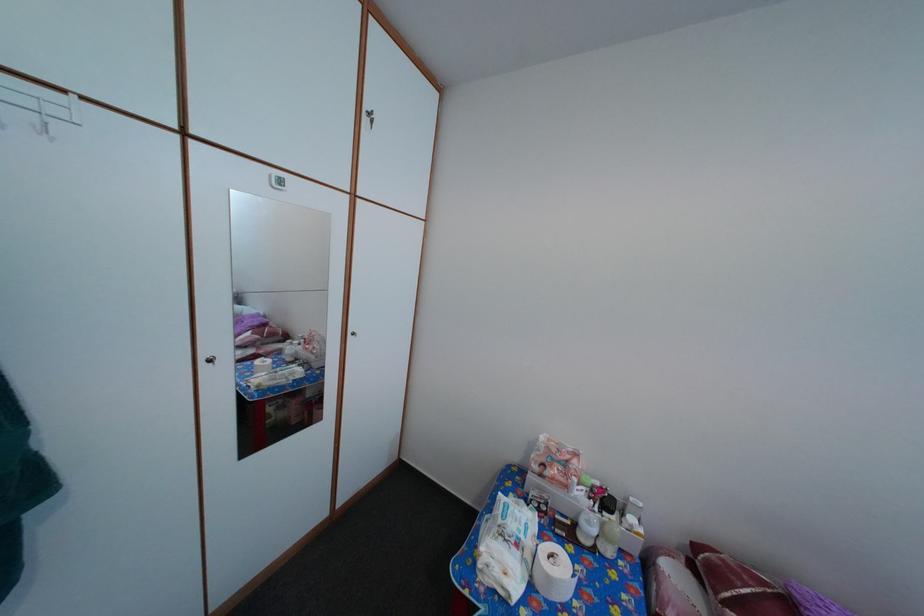
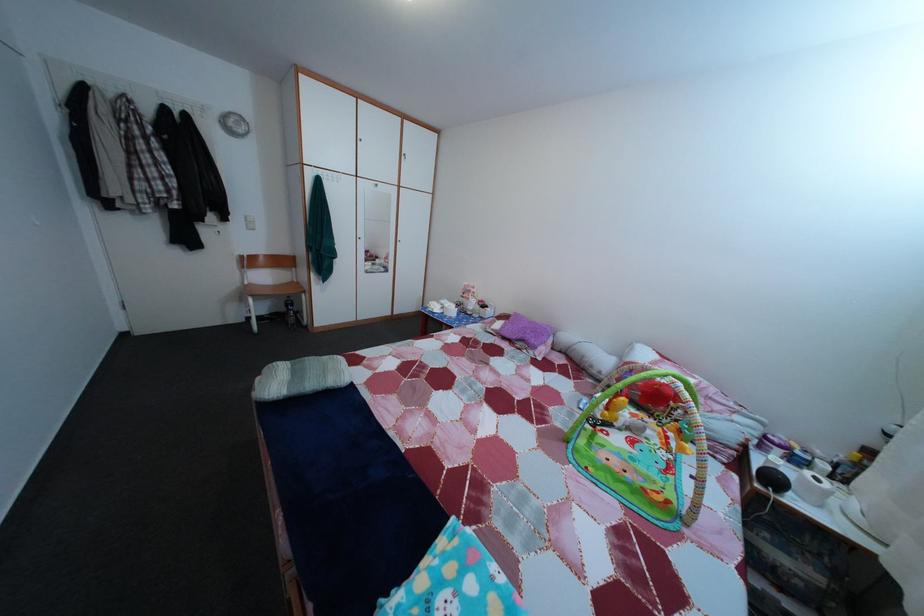
The images are taken continuously from a first-person perspective. In which direction are you moving?

The movement direction of the cameraman is right, backward.